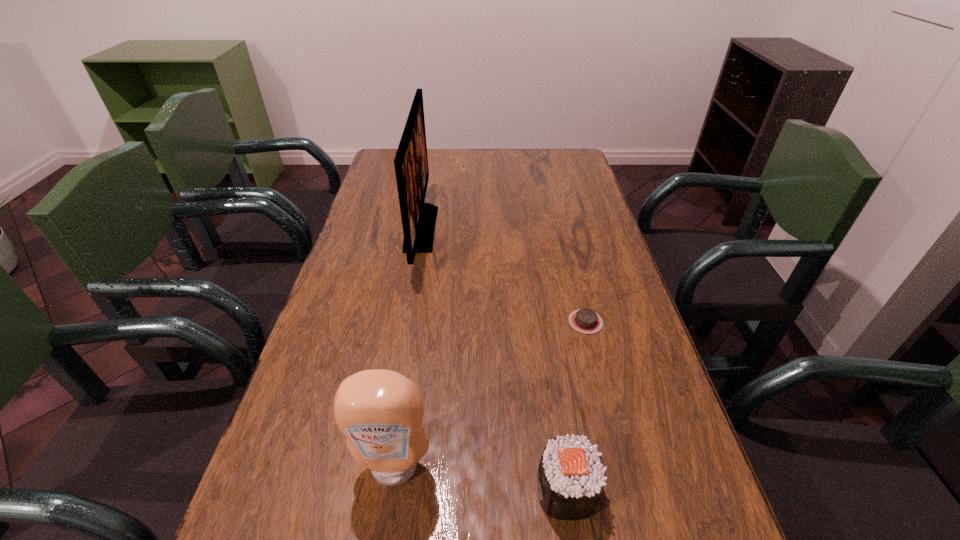
Where is `free space in the image that satisfies the following two spatial constraints: 1. on the back side of the sushi; 2. on the front-facing side of the farthest object`? Image resolution: width=960 pixels, height=540 pixels. free space in the image that satisfies the following two spatial constraints: 1. on the back side of the sushi; 2. on the front-facing side of the farthest object is located at coordinates (529, 228).

The height and width of the screenshot is (540, 960). What are the coordinates of `vacant region that satisfies the following two spatial constraints: 1. on the front-facing side of the monitor; 2. on the back side of the chocolate cake` in the screenshot? It's located at (405, 322).

You are a GUI agent. You are given a task and a screenshot of the screen. Output one action in this format:
    pyautogui.click(x=<x>, y=<y>)
    Task: Click on the vacant space that satisfies the following two spatial constraints: 1. on the front-facing side of the monitor; 2. on the right side of the shortest object
    
    Given the screenshot: What is the action you would take?
    pyautogui.click(x=405, y=322)

The width and height of the screenshot is (960, 540). Identify the location of vacant space that satisfies the following two spatial constraints: 1. on the front-facing side of the tallest object; 2. on the back side of the third object from left to right. (375, 490).